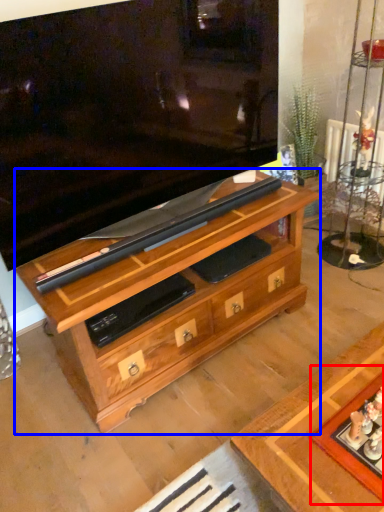
Question: Which object appears closest to the camera in this image, board game (highlighted by a red box) or chest of drawers (highlighted by a blue box)?

Choices:
 (A) board game
 (B) chest of drawers

Answer: (A)